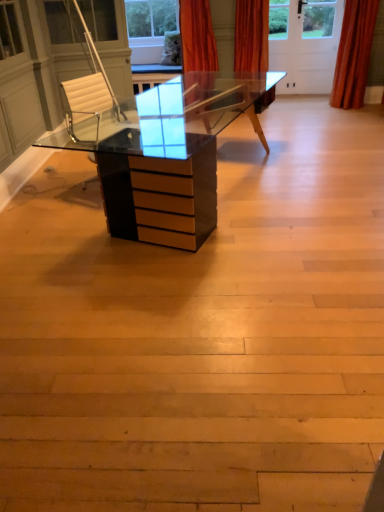
Question: Is orange velvet curtain at upper right, which appears as the 2th curtain when viewed from the left, inside or outside of orange velvet curtain at upper center, which is the first curtain from left to right?

Choices:
 (A) outside
 (B) inside

Answer: (A)

Question: Is orange velvet curtain at upper right, which appears as the 2th curtain when viewed from the left, wider or thinner than orange velvet curtain at upper center, which is the first curtain from left to right?

Choices:
 (A) thin
 (B) wide

Answer: (A)

Question: Considering their positions, is orange velvet curtain at upper right, which appears as the 2th curtain when viewed from the left, located in front of or behind orange velvet curtain at upper center, which ranks as the second curtain in right-to-left order?

Choices:
 (A) behind
 (B) front

Answer: (A)

Question: From the image's perspective, is orange velvet curtain at upper center, which is the first curtain from left to right, located above or below orange velvet curtain at upper right, which appears as the 2th curtain when viewed from the left?

Choices:
 (A) above
 (B) below

Answer: (A)

Question: Is orange velvet curtain at upper center, which is the first curtain from left to right, taller or shorter than orange velvet curtain at upper right, which appears as the 2th curtain when viewed from the left?

Choices:
 (A) tall
 (B) short

Answer: (B)

Question: Choose the correct answer: Is orange velvet curtain at upper center, which is the first curtain from left to right, inside orange velvet curtain at upper right, placed as the first curtain when sorted from right to left, or outside it?

Choices:
 (A) outside
 (B) inside

Answer: (A)

Question: In terms of width, does orange velvet curtain at upper center, which ranks as the second curtain in right-to-left order, look wider or thinner when compared to orange velvet curtain at upper right, which appears as the 2th curtain when viewed from the left?

Choices:
 (A) thin
 (B) wide

Answer: (B)